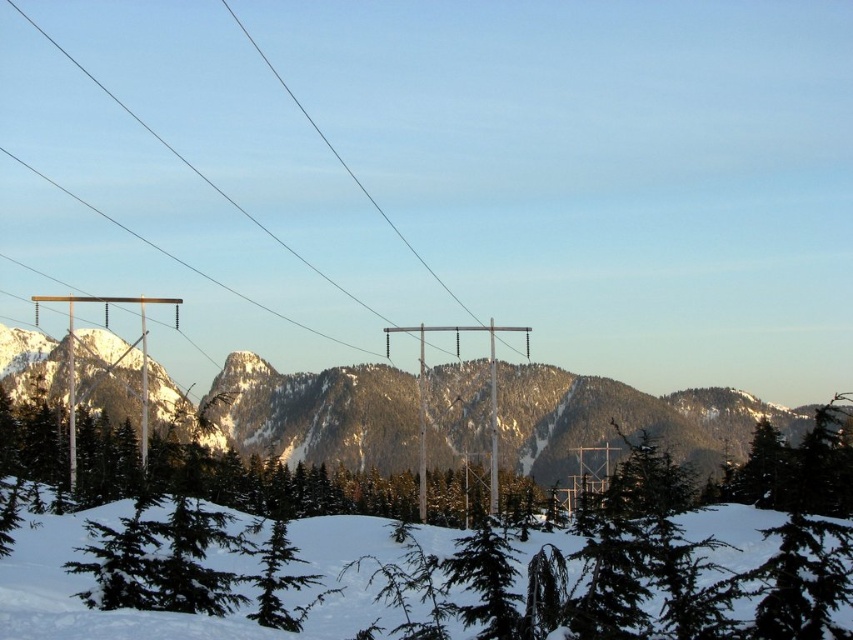
Image resolution: width=853 pixels, height=640 pixels. What are the coordinates of `snowy rock at center` in the screenshot? It's located at 624,419.

Between snowy rock at center and white snow at center, which one has less height?

Standing shorter between the two is white snow at center.

Who is more forward, (x=347, y=396) or (x=328, y=554)?

Point (x=328, y=554) is in front.

Find the location of `snowy rock at center`. snowy rock at center is located at coordinates (624, 419).

Is point (334, 570) less distant than point (119, 440)?

Yes.

Is white snow at center closer to camera compared to green matte tree at center?

Yes, it is.

The width and height of the screenshot is (853, 640). Describe the element at coordinates (131, 609) in the screenshot. I see `white snow at center` at that location.

Find the location of a particular element. white snow at center is located at coordinates click(x=131, y=609).

Which is in front, point (80, 355) or point (62, 474)?

Point (62, 474) is more forward.

Describe the element at coordinates (624, 419) in the screenshot. Image resolution: width=853 pixels, height=640 pixels. I see `snowy rock at center` at that location.

Between point (567, 467) and point (474, 490), which one is positioned in front?

Point (474, 490) is in front.

At what (x,y) coordinates should I click in order to perform the action: click on snowy rock at center. Please return your answer as a coordinate pair (x, y). Looking at the image, I should click on (624, 419).